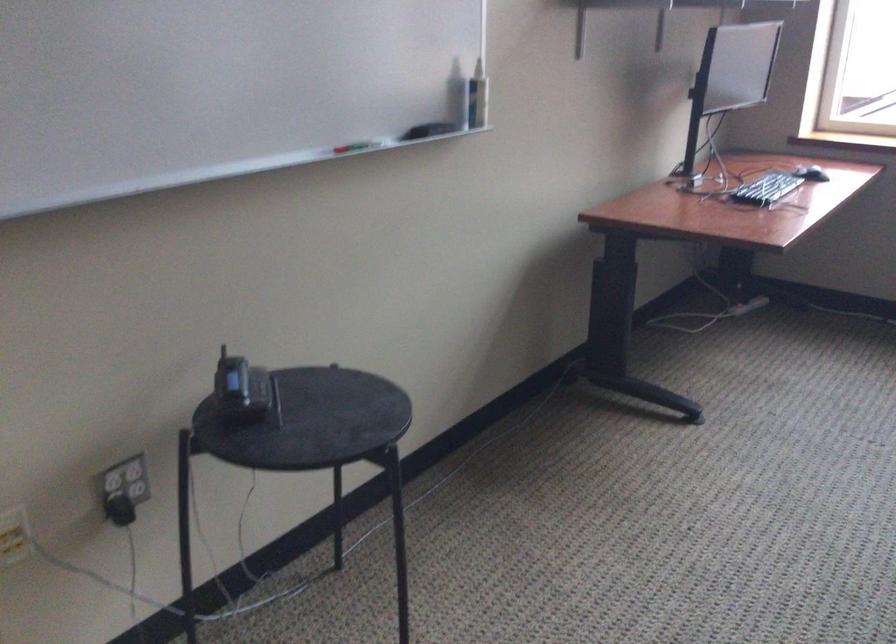
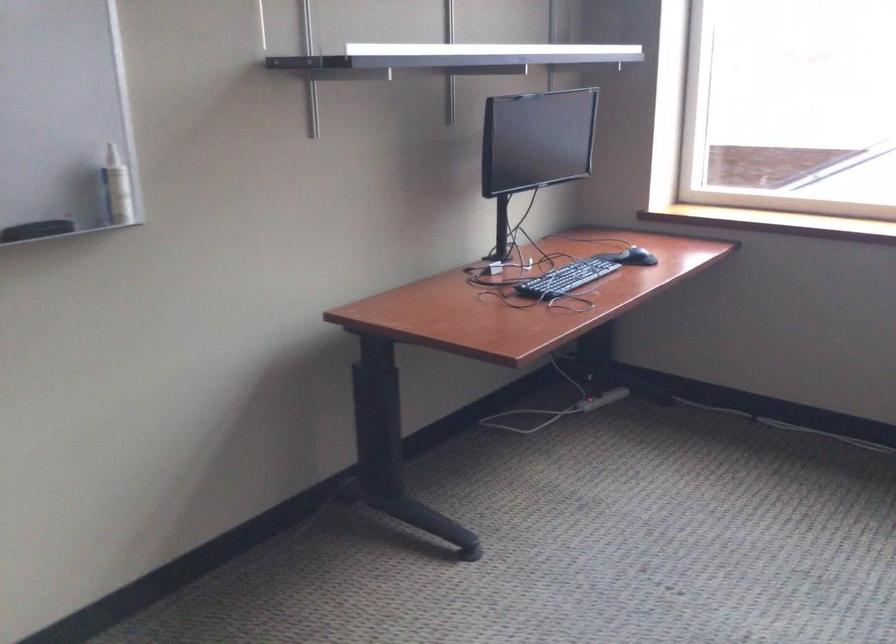
Locate, in the second image, the point that corresponds to (750,297) in the first image.

(587, 404)